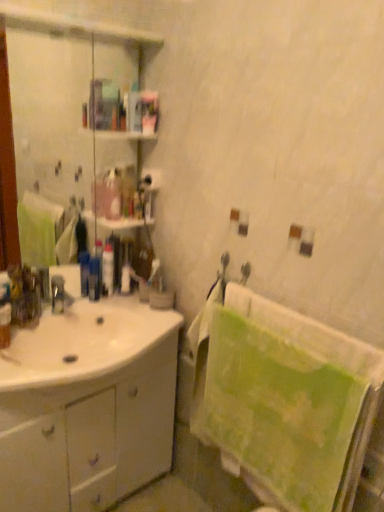
I want to click on spots to the right of matte silver faucet at center, so click(x=92, y=321).